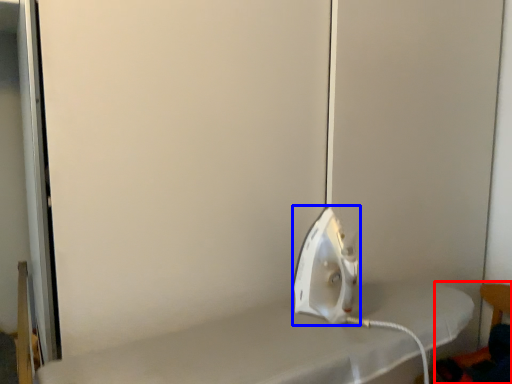
Question: Among these objects, which one is farthest to the camera, chair (highlighted by a red box) or appliance (highlighted by a blue box)?

Choices:
 (A) chair
 (B) appliance

Answer: (A)